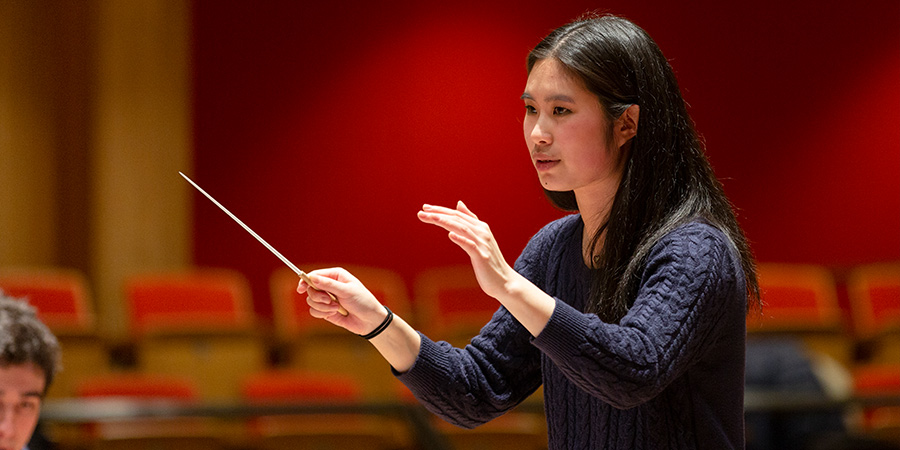
The height and width of the screenshot is (450, 900). Identify the location of theatre seats. (64, 295), (176, 290), (289, 306), (160, 386), (289, 383), (796, 286), (877, 290), (464, 304), (534, 396).